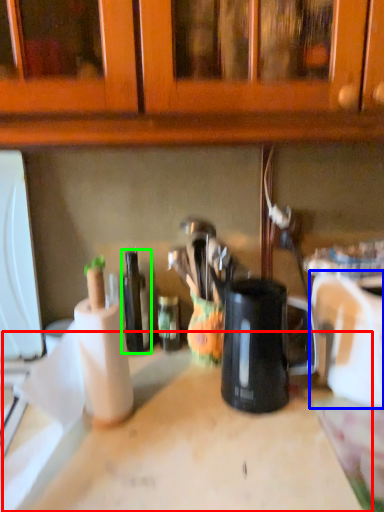
Question: Which is farther away from counter top (highlighted by a red box)? appliance (highlighted by a blue box) or bottle (highlighted by a green box)?

Choices:
 (A) appliance
 (B) bottle

Answer: (B)